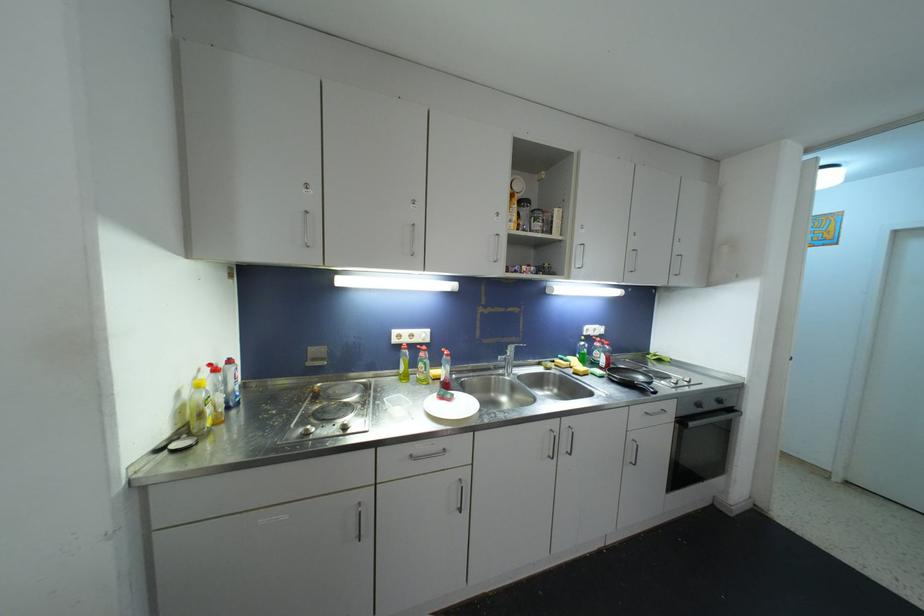
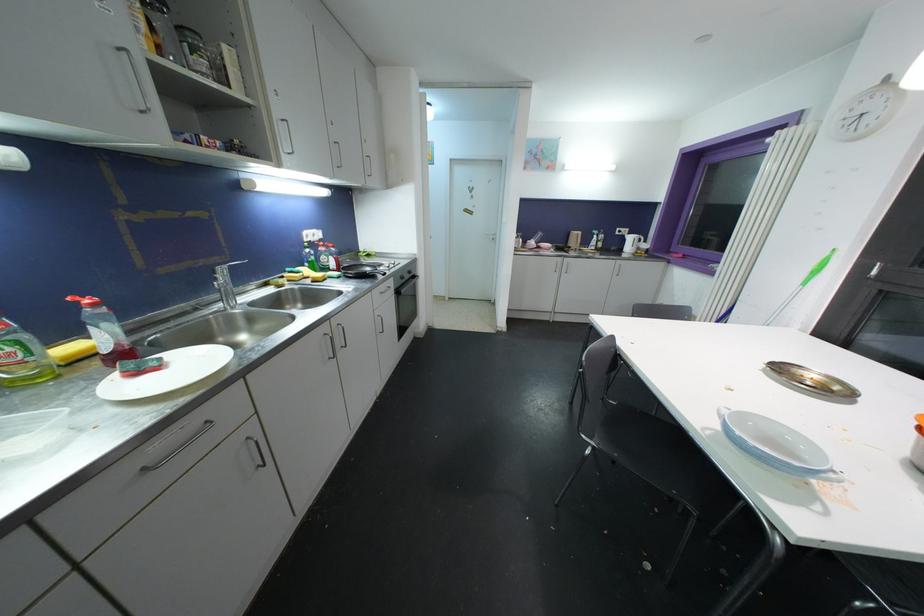
Locate, in the second image, the point that corresponds to point 450,358 in the first image.

(98, 308)